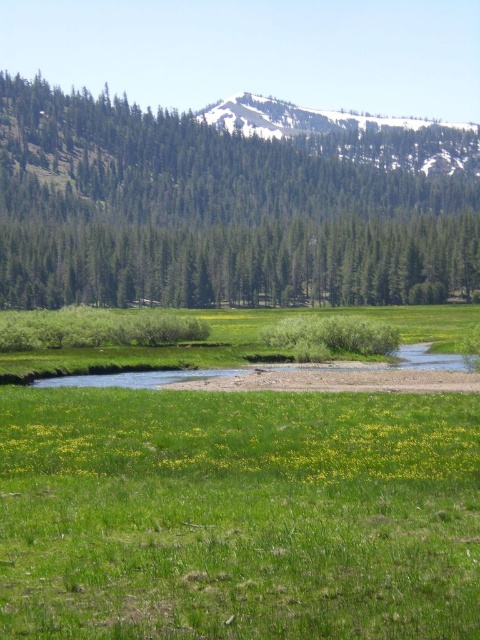
Question: Is green textured trees at left bigger than green grassy field at lower center?

Choices:
 (A) no
 (B) yes

Answer: (B)

Question: Does green textured trees at left appear on the right side of green grassy field at lower center?

Choices:
 (A) yes
 (B) no

Answer: (B)

Question: Which point is farther to the camera?

Choices:
 (A) (233, 438)
 (B) (421, 252)

Answer: (B)

Question: Which of the following is the farthest from the observer?

Choices:
 (A) (291, 296)
 (B) (237, 432)

Answer: (A)

Question: Observing the image, what is the correct spatial positioning of green textured trees at left in reference to green grassy field at lower center?

Choices:
 (A) above
 (B) below

Answer: (A)